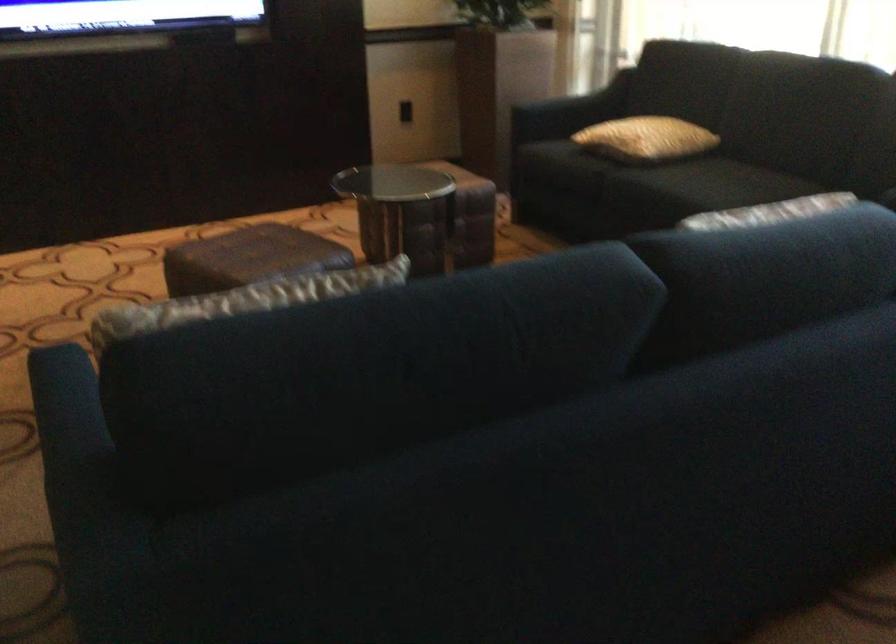
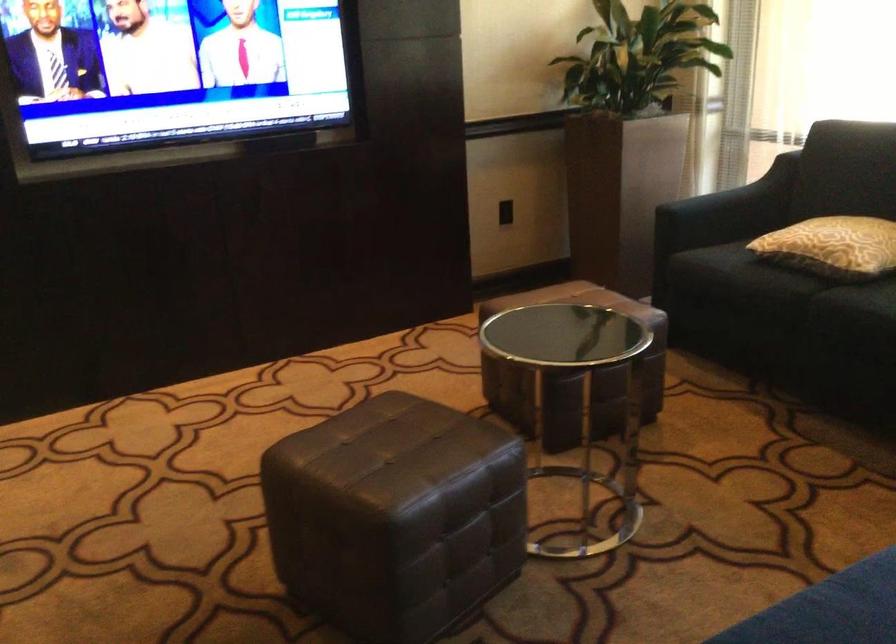
Where in the second image is the point corresponding to the point at 420,225 from the first image?

(573, 373)